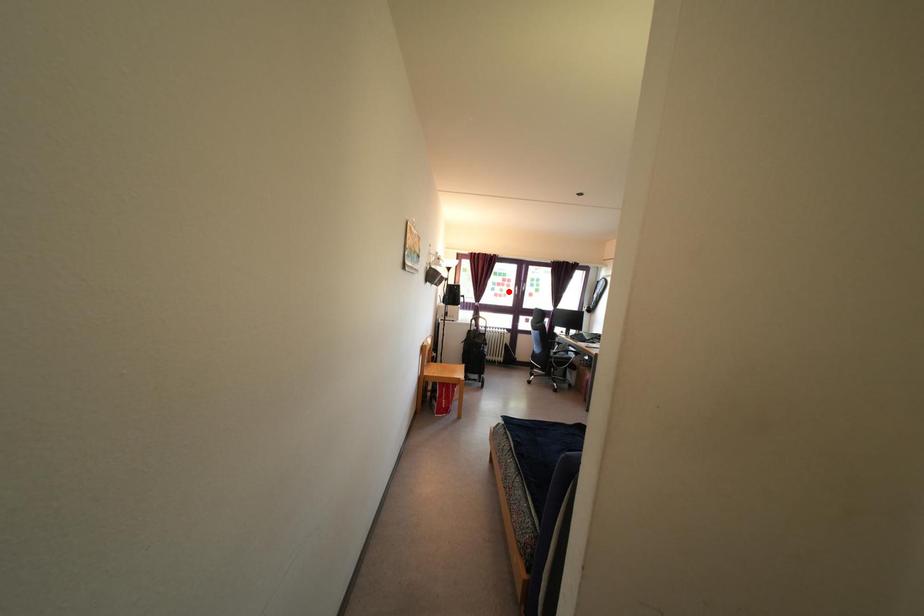
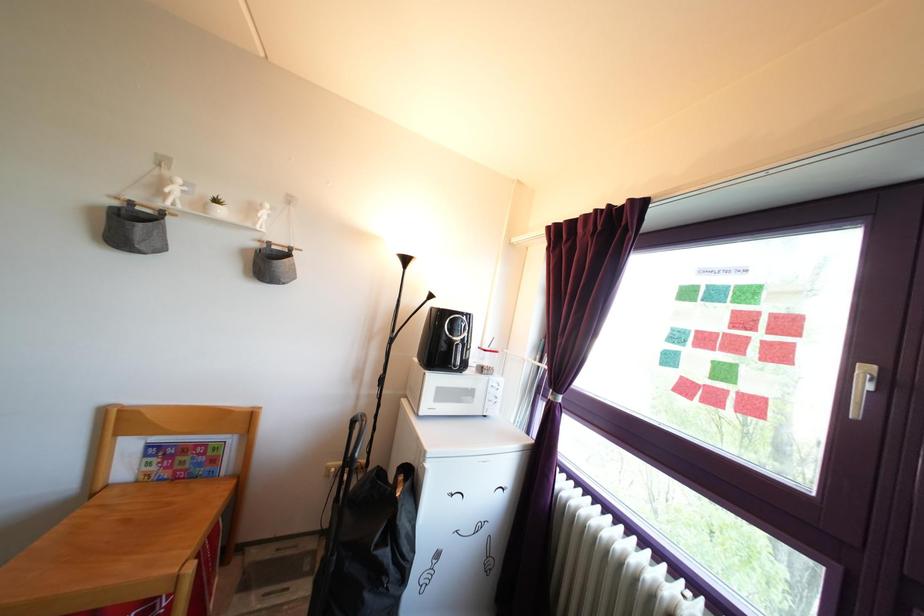
Question: I am providing you with two images of the same scene from different viewpoints. A red point is shown in image1. For the corresponding object point in image2, is it positioned nearer or farther from the camera?

Choices:
 (A) Nearer
 (B) Farther

Answer: (B)